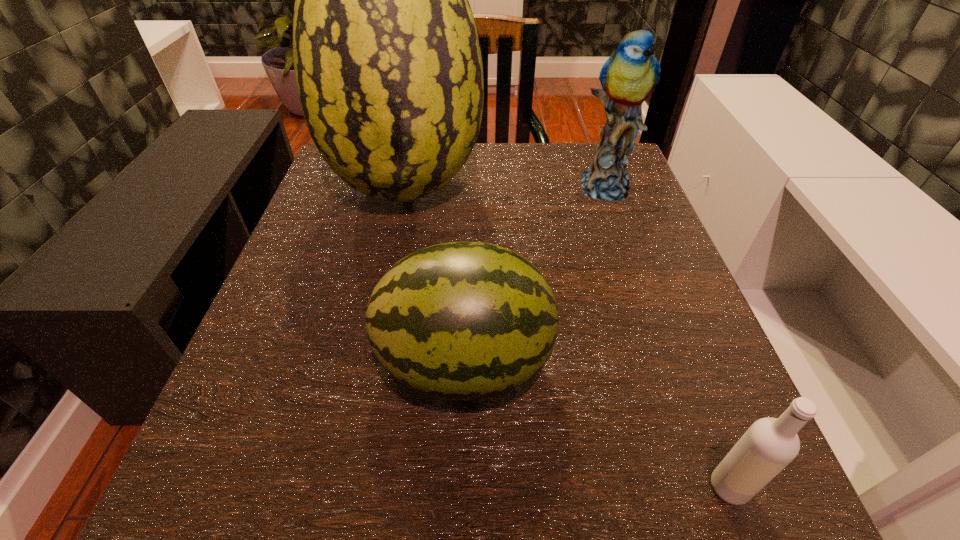
Locate an element on the screen. blank space at the near edge of the desktop is located at coordinates (361, 481).

Image resolution: width=960 pixels, height=540 pixels. Identify the location of free space at the left edge. (309, 444).

Locate an element on the screen. vacant space at the right edge of the desktop is located at coordinates (633, 222).

Where is `empty space between the taller watermelon and the second tallest object`? empty space between the taller watermelon and the second tallest object is located at coordinates (506, 188).

Where is `free space between the nearest object and the tallest object`? The image size is (960, 540). free space between the nearest object and the tallest object is located at coordinates (567, 338).

This screenshot has height=540, width=960. In order to click on free space between the vodka and the second nearest object in this screenshot , I will do point(596,425).

I want to click on empty location between the third shortest object and the farther watermelon, so click(506, 188).

Find the location of `vacant area that lies between the parrot and the nearest object`. vacant area that lies between the parrot and the nearest object is located at coordinates (666, 337).

At what (x,y) coordinates should I click in order to perform the action: click on vacant space that is in between the farther watermelon and the parrot. Please return your answer as a coordinate pair (x, y). This screenshot has height=540, width=960. Looking at the image, I should click on (506, 188).

The image size is (960, 540). What are the coordinates of `object that is the third closest to the nearest object` in the screenshot? It's located at (628, 77).